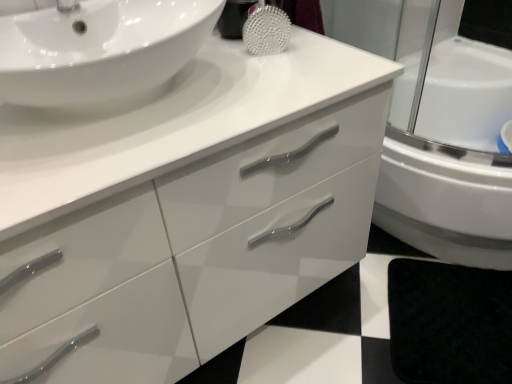
Image resolution: width=512 pixels, height=384 pixels. I want to click on black matte bath mat at lower right, so click(449, 323).

Describe the element at coordinates (100, 50) in the screenshot. The image size is (512, 384). I see `white glossy sink at upper left` at that location.

I want to click on glossy white cabinet at center, so click(x=195, y=252).

Which of these two, black matte bath mat at lower right or white glossy sink at upper left, is wider?

With larger width is black matte bath mat at lower right.

Is black matte bath mat at lower right positioned with its back to white glossy sink at upper left?

No, black matte bath mat at lower right is not facing away from white glossy sink at upper left.

Image resolution: width=512 pixels, height=384 pixels. Identify the location of sink to the left of black matte bath mat at lower right. (100, 50).

How much distance is there between black matte bath mat at lower right and white glossy sink at upper left?

black matte bath mat at lower right is 3.46 feet away from white glossy sink at upper left.

From the image's perspective, which object appears higher, glossy white cabinet at center or black matte bath mat at lower right?

glossy white cabinet at center is shown above in the image.

Who is taller, glossy white cabinet at center or black matte bath mat at lower right?

Standing taller between the two is glossy white cabinet at center.

Visually, is glossy white cabinet at center positioned to the left or to the right of black matte bath mat at lower right?

glossy white cabinet at center is to the left of black matte bath mat at lower right.

From a real-world perspective, who is located higher, glossy white cabinet at center or black matte bath mat at lower right?

glossy white cabinet at center is physically above.

What's the angular difference between black matte bath mat at lower right and glossy white cabinet at center's facing directions?

The facing directions of black matte bath mat at lower right and glossy white cabinet at center are 47.3 degrees apart.

How far apart are black matte bath mat at lower right and glossy white cabinet at center?

50.78 centimeters.

From the image's perspective, is black matte bath mat at lower right located above glossy white cabinet at center?

Incorrect, from the image's perspective, black matte bath mat at lower right is lower than glossy white cabinet at center.

The image size is (512, 384). Identify the location of bathroom cabinet above the black matte bath mat at lower right (from a real-world perspective). (195, 252).

Which object is more forward, white glossy sink at upper left or black matte bath mat at lower right?

white glossy sink at upper left.

From a real-world perspective, is white glossy sink at upper left positioned over black matte bath mat at lower right based on gravity?

Correct, in the physical world, white glossy sink at upper left is higher than black matte bath mat at lower right.

Can you confirm if white glossy sink at upper left is shorter than black matte bath mat at lower right?

No, white glossy sink at upper left is not shorter than black matte bath mat at lower right.

From the image's perspective, which one is positioned lower, glossy white cabinet at center or white glossy sink at upper left?

glossy white cabinet at center.

Based on the photo, does glossy white cabinet at center have a smaller size compared to white glossy sink at upper left?

No.

From a real-world perspective, is glossy white cabinet at center over white glossy sink at upper left?

Incorrect, from a real-world perspective, glossy white cabinet at center is lower than white glossy sink at upper left.

Considering the relative sizes of white glossy sink at upper left and glossy white cabinet at center in the image provided, is white glossy sink at upper left bigger than glossy white cabinet at center?

No.

From a real-world perspective, does white glossy sink at upper left stand above glossy white cabinet at center?

Yes, from a real-world perspective, white glossy sink at upper left is over glossy white cabinet at center

In the image, there is a white glossy sink at upper left. Where is `bathroom cabinet below it (from a real-world perspective)`? This screenshot has width=512, height=384. bathroom cabinet below it (from a real-world perspective) is located at coordinates (195, 252).

From the image's perspective, is white glossy sink at upper left located above or below glossy white cabinet at center?

From the image's perspective, white glossy sink at upper left appears above glossy white cabinet at center.

Find the location of a particular element. sink that appears on the left of black matte bath mat at lower right is located at coordinates (100, 50).

Identify the location of bathroom cabinet that is in front of the black matte bath mat at lower right. The image size is (512, 384). (195, 252).

When comparing their distances from white glossy sink at upper left, does glossy white cabinet at center or black matte bath mat at lower right seem further?

Among the two, black matte bath mat at lower right is located further to white glossy sink at upper left.

From the image, which object appears to be nearer to glossy white cabinet at center, black matte bath mat at lower right or white glossy sink at upper left?

white glossy sink at upper left is closer to glossy white cabinet at center.

Estimate the real-world distances between objects in this image. Which object is further from glossy white cabinet at center, white glossy sink at upper left or black matte bath mat at lower right?

Based on the image, black matte bath mat at lower right appears to be further to glossy white cabinet at center.

Based on their spatial positions, is glossy white cabinet at center or white glossy sink at upper left closer to black matte bath mat at lower right?

Based on the image, glossy white cabinet at center appears to be nearer to black matte bath mat at lower right.

Looking at the image, which one is located closer to white glossy sink at upper left, black matte bath mat at lower right or glossy white cabinet at center?

glossy white cabinet at center lies closer to white glossy sink at upper left than the other object.

Estimate the real-world distances between objects in this image. Which object is closer to black matte bath mat at lower right, white glossy sink at upper left or glossy white cabinet at center?

glossy white cabinet at center lies closer to black matte bath mat at lower right than the other object.

Locate an element on the screen. The height and width of the screenshot is (384, 512). bathroom cabinet situated between white glossy sink at upper left and black matte bath mat at lower right from left to right is located at coordinates (195, 252).